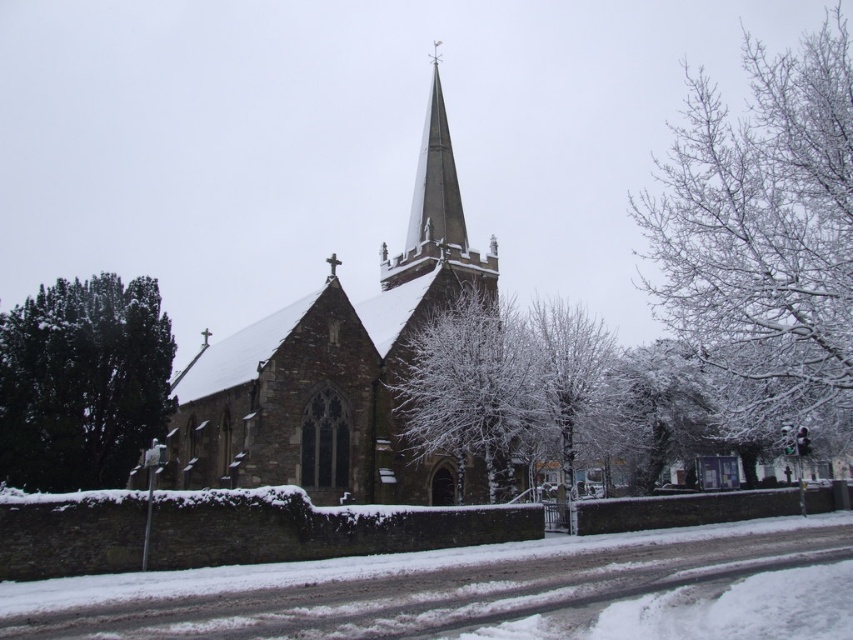
Question: Which object is positioned closest to the white frosty tree at center?

Choices:
 (A) stone church at center
 (B) smooth gray steeple at center
 (C) green textured tree at left

Answer: (A)

Question: Is stone church at center smaller than white frosty tree at center?

Choices:
 (A) yes
 (B) no

Answer: (B)

Question: Does green textured tree at left appear over smooth gray steeple at center?

Choices:
 (A) no
 (B) yes

Answer: (A)

Question: Where is green textured tree at left located in relation to smooth gray steeple at center in the image?

Choices:
 (A) left
 (B) right

Answer: (A)

Question: Which point appears farthest from the camera in this image?

Choices:
 (A) (553, 362)
 (B) (410, 246)

Answer: (B)

Question: Estimate the real-world distances between objects in this image. Which object is closer to the white snow-covered tree at right?

Choices:
 (A) white snow-covered tree at center
 (B) green textured tree at left
 (C) white frosty tree at center

Answer: (A)